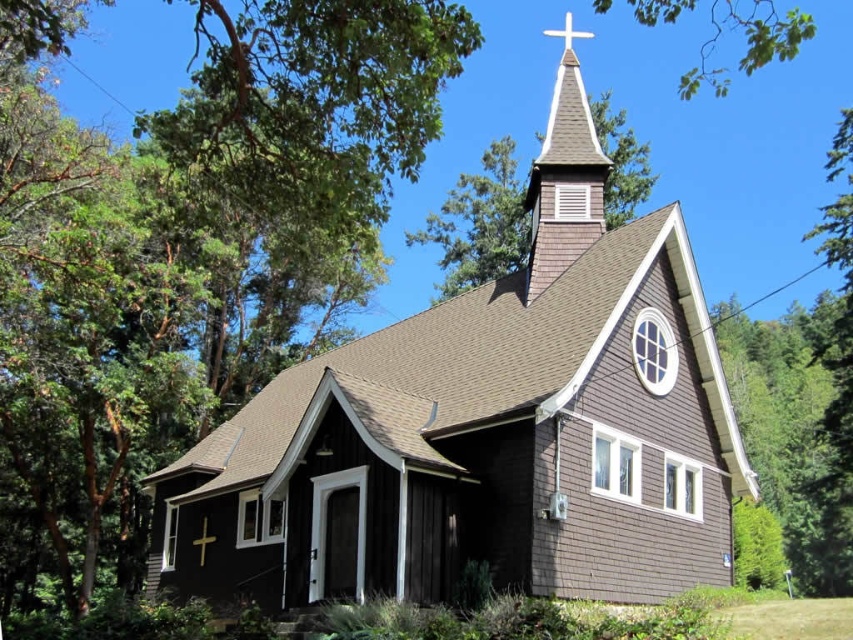
You are standing in front of the church and notice two points marked on the building. Which point is closer to you, point 1 at coordinates (190, 532) or point 2 at coordinates (199, 538)?

Point 1 at coordinates (190, 532) is closer to you because it is further to the viewer than point 2 at coordinates (199, 538).

You are a painter planning to paint the brown shingles church at center and the brown shingles at upper center. Which of the two has a larger width?

The brown shingles church at center has a larger width than the brown shingles at upper center.

From the picture: You are standing in front of the church and notice two crosses. The first is the white wooden cross at upper center and the second is the gold metallic cross at center. Which cross is wider?

The white wooden cross at upper center is wider than the gold metallic cross at center.